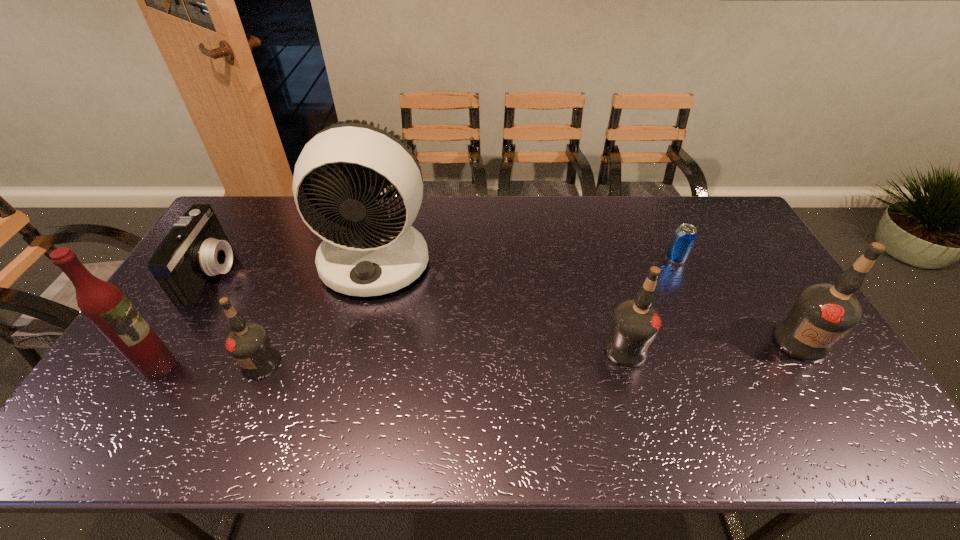
Please mark a free spot for a new vodka to balance the arrangement. Please provide its 2D coordinates. Your answer should be formatted as a tuple, i.e. [(x, y)], where the tuple contains the x and y coordinates of a point satisfying the conditions above.

[(445, 356)]